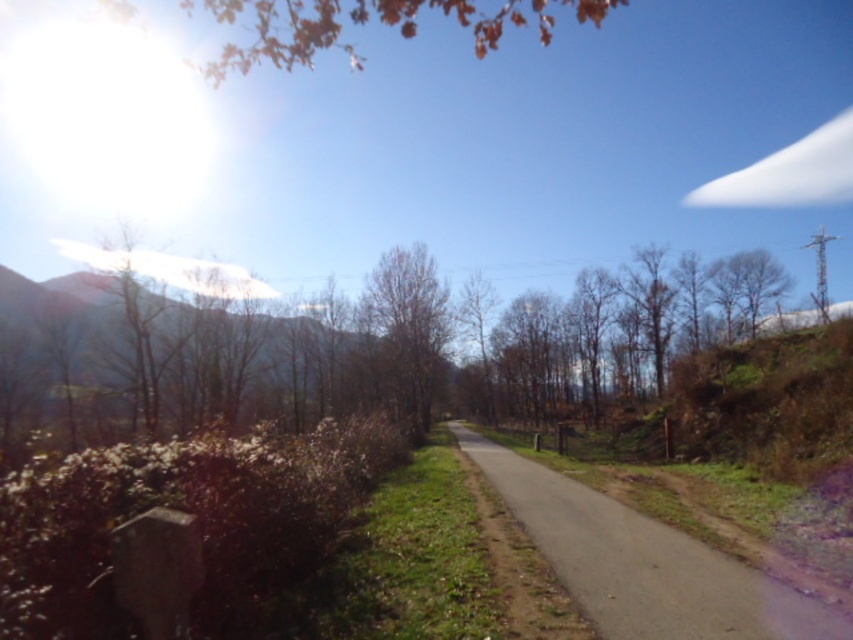
Does gray asphalt road at center have a lesser height compared to brown leafless tree at center?

Yes, gray asphalt road at center is shorter than brown leafless tree at center.

Can you confirm if gray asphalt road at center is positioned to the right of brown leafless tree at center?

Indeed, gray asphalt road at center is positioned on the right side of brown leafless tree at center.

Describe the element at coordinates (643, 563) in the screenshot. The height and width of the screenshot is (640, 853). I see `gray asphalt road at center` at that location.

In order to click on gray asphalt road at center in this screenshot , I will do coord(643,563).

I want to click on brown textured mountain at left, so click(x=257, y=337).

Between point (161, 314) and point (403, 324), which one is positioned behind?

The point (403, 324) is behind.

I want to click on brown textured mountain at left, so click(x=257, y=337).

Between gray asphalt road at center and brown textured mountain at left, which one is positioned lower?

gray asphalt road at center is lower down.

The image size is (853, 640). What are the coordinates of `gray asphalt road at center` in the screenshot? It's located at (643, 563).